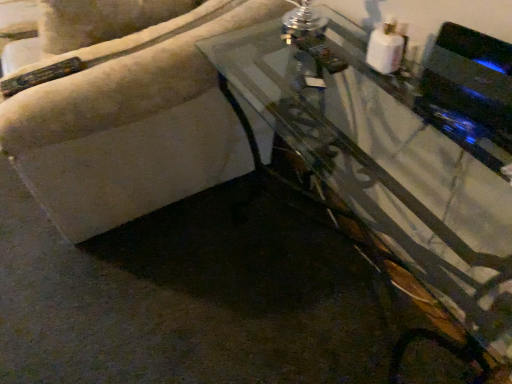
Find the location of a particular element. This screenshot has height=384, width=512. black glossy speaker at upper right is located at coordinates (471, 76).

What is the approximate width of black glossy speaker at upper right?

The width of black glossy speaker at upper right is 10.55 centimeters.

This screenshot has width=512, height=384. Describe the element at coordinates (471, 76) in the screenshot. I see `black glossy speaker at upper right` at that location.

The height and width of the screenshot is (384, 512). In order to click on transparent glass table at center in this screenshot , I will do (399, 161).

Describe the element at coordinates (399, 161) in the screenshot. This screenshot has width=512, height=384. I see `transparent glass table at center` at that location.

Measure the distance between transparent glass table at center and camera.

The depth of transparent glass table at center is 27.19 inches.

Identify the location of black glossy speaker at upper right. (471, 76).

Is black glossy speaker at upper right to the left or to the right of transparent glass table at center in the image?

From the image, it's evident that black glossy speaker at upper right is to the right of transparent glass table at center.

Which object is more forward, black glossy speaker at upper right or transparent glass table at center?

transparent glass table at center is closer to the camera.

Does point (457, 48) lie in front of point (280, 23)?

That is True.

Consider the image. From the image's perspective, is black glossy speaker at upper right above or below transparent glass table at center?

From the image's perspective, black glossy speaker at upper right appears above transparent glass table at center.

From a real-world perspective, is black glossy speaker at upper right above or below transparent glass table at center?

Clearly, from a real-world perspective, black glossy speaker at upper right is above transparent glass table at center.

Between black glossy speaker at upper right and transparent glass table at center, which one has larger width?

transparent glass table at center is wider.

Considering the sizes of black glossy speaker at upper right and transparent glass table at center in the image, is black glossy speaker at upper right taller or shorter than transparent glass table at center?

black glossy speaker at upper right is shorter than transparent glass table at center.

Between black glossy speaker at upper right and transparent glass table at center, which one has larger size?

transparent glass table at center.

Would you say black glossy speaker at upper right is outside transparent glass table at center?

Yes, black glossy speaker at upper right is outside of transparent glass table at center.

Is black glossy speaker at upper right positioned far away from transparent glass table at center?

No, black glossy speaker at upper right is not far away from transparent glass table at center.

Is black glossy speaker at upper right aimed at transparent glass table at center?

No, black glossy speaker at upper right is not oriented towards transparent glass table at center.

Where is `appliance behind the transparent glass table at center`? This screenshot has width=512, height=384. appliance behind the transparent glass table at center is located at coordinates (471, 76).

Is transparent glass table at center at the left side of black glossy speaker at upper right?

Correct, you'll find transparent glass table at center to the left of black glossy speaker at upper right.

Is transparent glass table at center positioned in front of black glossy speaker at upper right?

Yes, it is.

Is point (401, 226) closer or farther from the camera than point (490, 45)?

Point (401, 226) is positioned closer to the camera compared to point (490, 45).

From the image's perspective, is transparent glass table at center above or below black glossy speaker at upper right?

transparent glass table at center is below black glossy speaker at upper right.

From a real-world perspective, which object rests below the other?

transparent glass table at center.

Which object is thinner, transparent glass table at center or black glossy speaker at upper right?

black glossy speaker at upper right is thinner.

Does transparent glass table at center have a greater height compared to black glossy speaker at upper right?

Yes, transparent glass table at center is taller than black glossy speaker at upper right.

Consider the image. Is transparent glass table at center bigger than black glossy speaker at upper right?

Correct, transparent glass table at center is larger in size than black glossy speaker at upper right.

Is transparent glass table at center inside or outside of black glossy speaker at upper right?

The correct answer is: outside.

Is transparent glass table at center with black glossy speaker at upper right?

No, transparent glass table at center is not beside black glossy speaker at upper right.

Is transparent glass table at center turned away from black glossy speaker at upper right?

transparent glass table at center is not turned away from black glossy speaker at upper right.

Identify the location of appliance on the right of transparent glass table at center. (471, 76).

Find the location of a particular element. Image resolution: width=512 pixels, height=384 pixels. appliance on the right of the transparent glass table at center is located at coordinates coord(471,76).

This screenshot has height=384, width=512. I want to click on appliance positioned vertically above the transparent glass table at center (from a real-world perspective), so click(x=471, y=76).